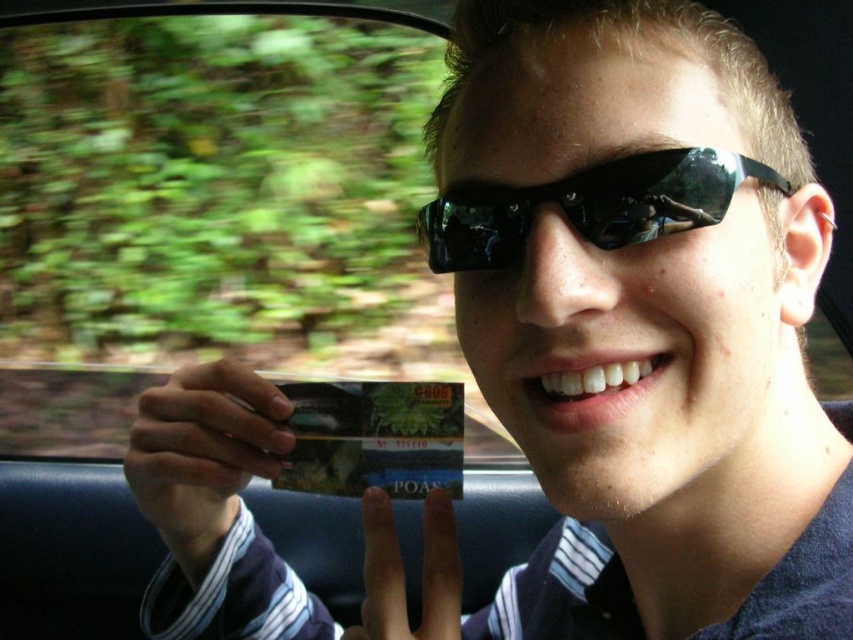
Between black reflective sunglasses at center and metallic green credit card at center, which one has more height?

metallic green credit card at center is taller.

Does point (691, 227) come in front of point (432, 444)?

Yes, it is.

Identify the location of black reflective sunglasses at center. (589, 205).

You are a GUI agent. You are given a task and a screenshot of the screen. Output one action in this format:
    pyautogui.click(x=<x>, y=<y>)
    Task: Click on the black reflective sunglasses at center
    Image resolution: width=853 pixels, height=640 pixels.
    Given the screenshot: What is the action you would take?
    pyautogui.click(x=589, y=205)